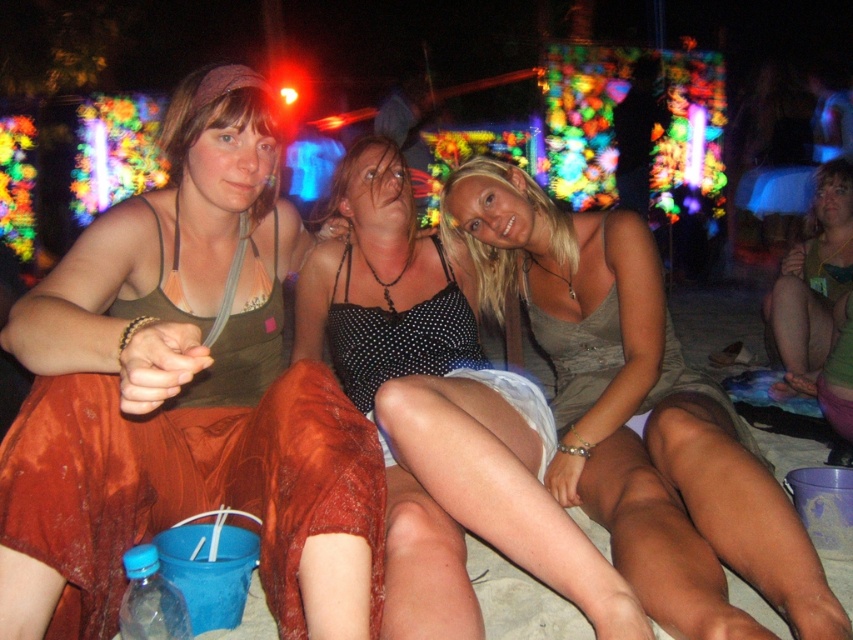
You are a photographer trying to capture the vibrant colors of the nighttime beach scene. You notice the matte green tank top at center and the matte gray dress at center. Which clothing item is covering part of the other?

The matte green tank top at center is positioned over matte gray dress at center, so the matte green tank top at center is covering part of the matte gray dress at center.

You are a photographer at the beach party trying to capture a candid shot of the two people wearing the matte green tank top at center and the matte gray dress at center. Since you want to ensure both are clearly visible, which clothing item should you focus on first to ensure it doesn t get cropped out of the frame?

The matte green tank top at center is smaller than the matte gray dress at center, so you should focus on the matte gray dress at center first as it is larger and might require more framing space to avoid cropping.

You are a photographer at the beach party. You want to take a photo that includes both the polka dot tank top at center and the green fabric dress at lower right. Which object should you focus on first to ensure both are in frame?

You should focus on the polka dot tank top at center first because it is larger in size than the green fabric dress at lower right, making it easier to frame both objects in the photo.